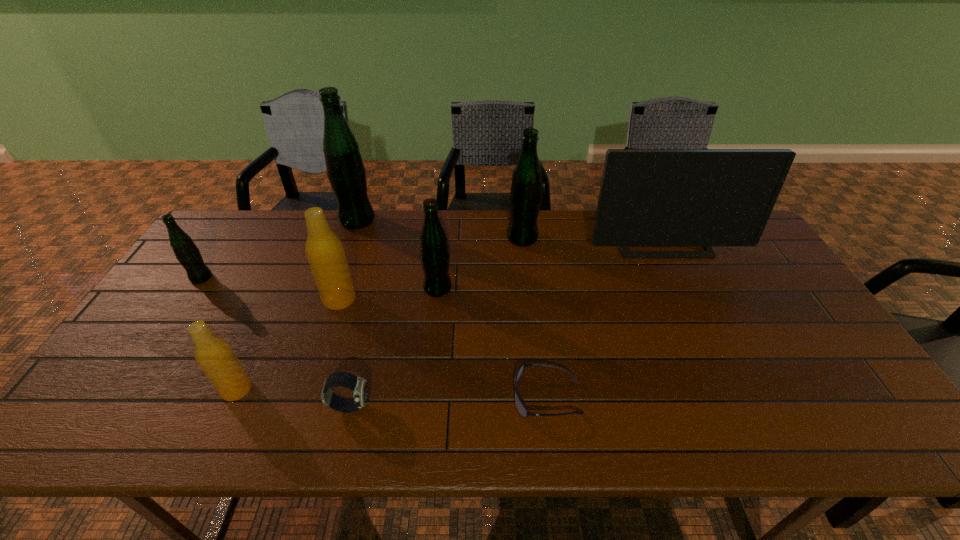
This screenshot has width=960, height=540. Find the location of `the smallest green beer bottle`. the smallest green beer bottle is located at coordinates (187, 253).

In order to click on the leftmost beer bottle in this screenshot , I will do `click(187, 253)`.

At what (x,y) coordinates should I click in order to perform the action: click on the second beer bottle from left to right. Please return your answer as a coordinate pair (x, y). Looking at the image, I should click on (214, 355).

This screenshot has width=960, height=540. What are the coordinates of `the eighth object from right to left` in the screenshot? It's located at (214, 355).

At what (x,y) coordinates should I click in order to perform the action: click on dark watch. Please return your answer as a coordinate pair (x, y). The width and height of the screenshot is (960, 540). Looking at the image, I should click on (359, 386).

Identify the location of watch. (359, 386).

Image resolution: width=960 pixels, height=540 pixels. In order to click on sunglasses in this screenshot , I will do `click(522, 410)`.

The width and height of the screenshot is (960, 540). In order to click on free region located on the left of the third green beer bottle from right to left in this screenshot , I will do `click(236, 220)`.

The height and width of the screenshot is (540, 960). Find the location of `vacant area situated 0.060m on the back of the second tallest beer bottle`. vacant area situated 0.060m on the back of the second tallest beer bottle is located at coordinates (520, 219).

I want to click on free region located on the screen side of the computer monitor, so click(695, 312).